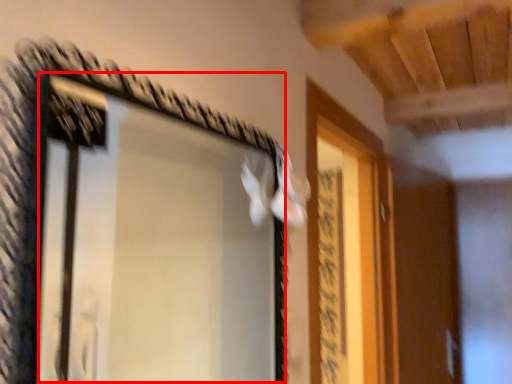
Question: From the image's perspective, considering the relative positions of window (annotated by the red box) and screen door in the image provided, where is window (annotated by the red box) located with respect to the staircase?

Choices:
 (A) below
 (B) above

Answer: (B)